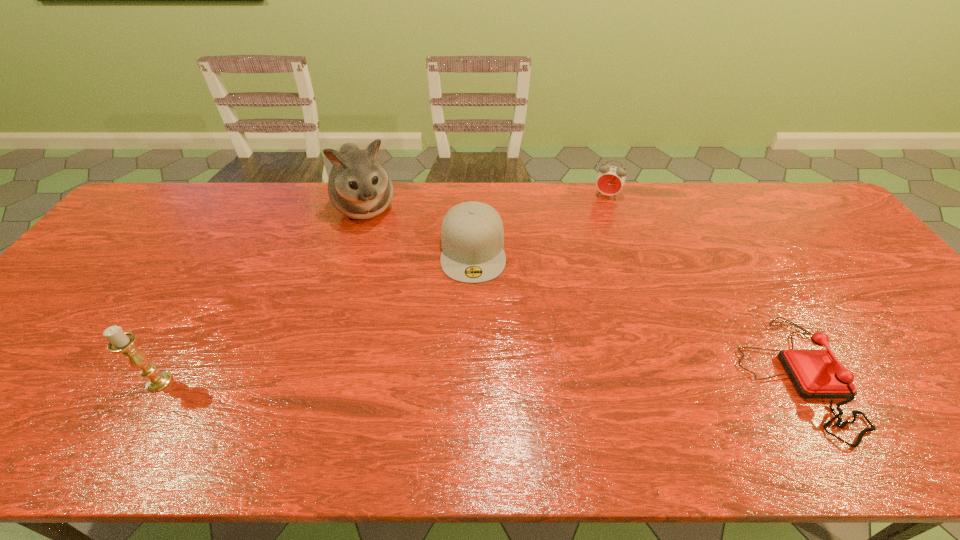
Identify the location of vacant spot on the desktop that is between the second tallest object and the telephone and is positioned on the face of the tallest object. (448, 380).

The width and height of the screenshot is (960, 540). Find the location of `vacant space on the desktop that is between the second tallest object and the shortest object and is positioned on the face of the third tallest object`. vacant space on the desktop that is between the second tallest object and the shortest object and is positioned on the face of the third tallest object is located at coordinates (541, 379).

The image size is (960, 540). I want to click on free spot on the desktop that is between the leftmost object and the rightmost object and is positioned on the front-facing side of the third object from right to left, so point(477,380).